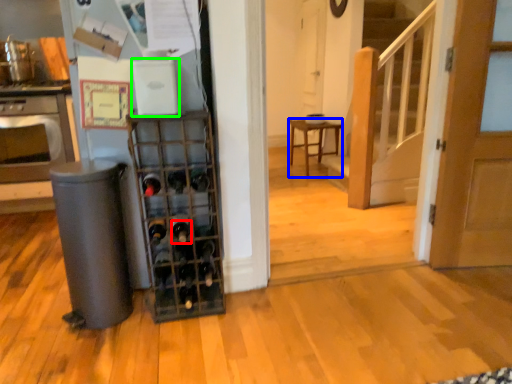
Question: Estimate the real-world distances between objects in this image. Which object is farther from wine bottle (highlighted by a red box), furniture (highlighted by a blue box) or appliance (highlighted by a green box)?

Choices:
 (A) furniture
 (B) appliance

Answer: (A)